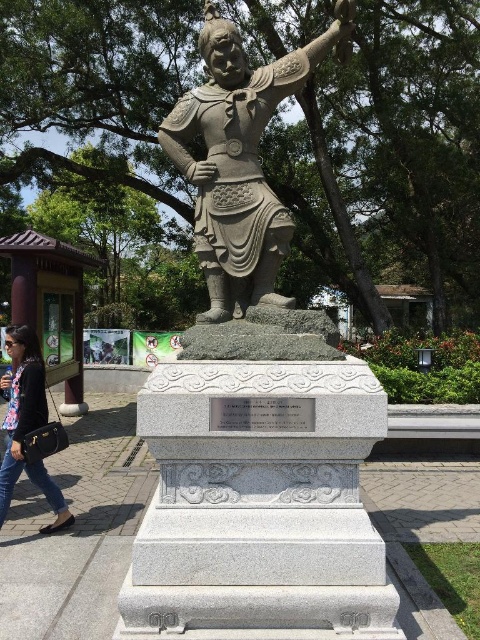
Which is above, gray stone pavement at center or bronze statue at center?

bronze statue at center is higher up.

Between gray stone pavement at center and bronze statue at center, which one has more height?

bronze statue at center

Between point (367, 499) and point (236, 141), which one is positioned behind?

Point (367, 499)

Locate an element on the screen. gray stone pavement at center is located at coordinates (76, 531).

Is gray stone pavement at center shorter than denim jeans at lower left?

Yes, gray stone pavement at center is shorter than denim jeans at lower left.

The width and height of the screenshot is (480, 640). What do you see at coordinates (76, 531) in the screenshot? I see `gray stone pavement at center` at bounding box center [76, 531].

The image size is (480, 640). In order to click on gray stone pavement at center in this screenshot , I will do `click(76, 531)`.

Can you confirm if gray stone statue at center is positioned below denim jeans at lower left?

Incorrect, gray stone statue at center is not positioned below denim jeans at lower left.

Locate an element on the screen. The height and width of the screenshot is (640, 480). gray stone statue at center is located at coordinates (253, 404).

Who is more forward, (375,620) or (0,470)?

Point (375,620) is in front.

Find the location of `gray stone statue at center`. gray stone statue at center is located at coordinates (253, 404).